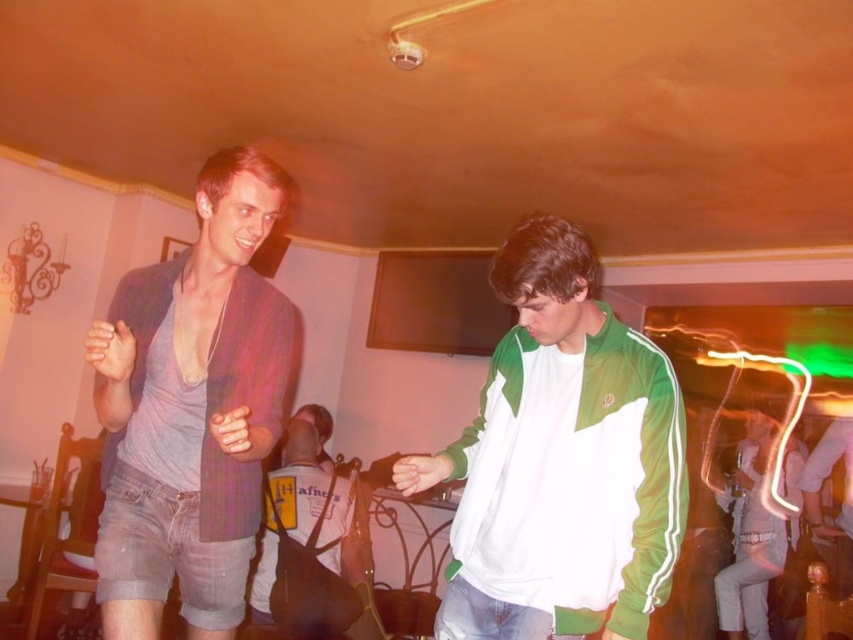
You are at a party and want to take a photo of both the yellow fabric backpack at center and the white satin dress at lower right. Which object should you focus on first to ensure both are in the frame?

You should focus on the yellow fabric backpack at center first since it is in front of the white satin dress at lower right, ensuring both are visible in the photo.